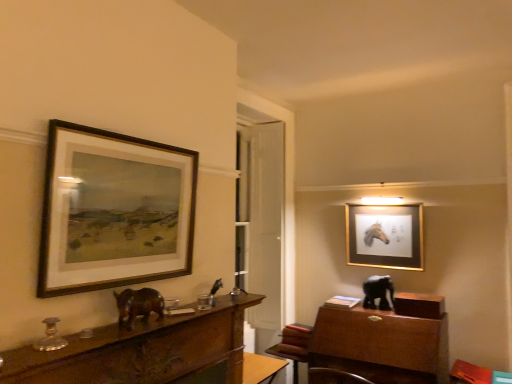
Identify the location of free space above wooden-framed painting at upper left, which appears as the first picture frame when viewed from the left (from a real-world perspective). This screenshot has width=512, height=384. (128, 140).